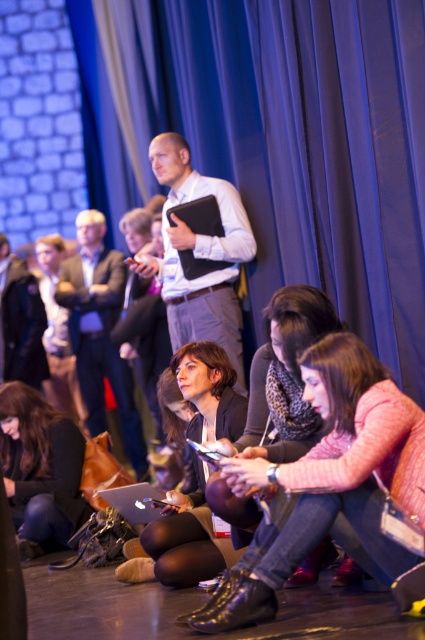
You are a photographer trying to capture a candid shot of the matte black jacket at center and the matte black laptop at lower left. Since both are matte black, you want to ensure you can distinguish them in the photo. Based on their sizes, which object should you focus on to ensure it appears larger in the frame?

The matte black laptop at lower left should be focused on to appear larger since the matte black jacket at center is not as tall as the matte black laptop at lower left.

You are an attendee at this conference and want to borrow a laptop charger from someone. You see the matte black jacket at center and the matte black laptop at lower left. Which object is closer to the left side of the scene?

The matte black laptop at lower left is closer to the left side of the scene because it is positioned to the left of the matte black jacket at center.